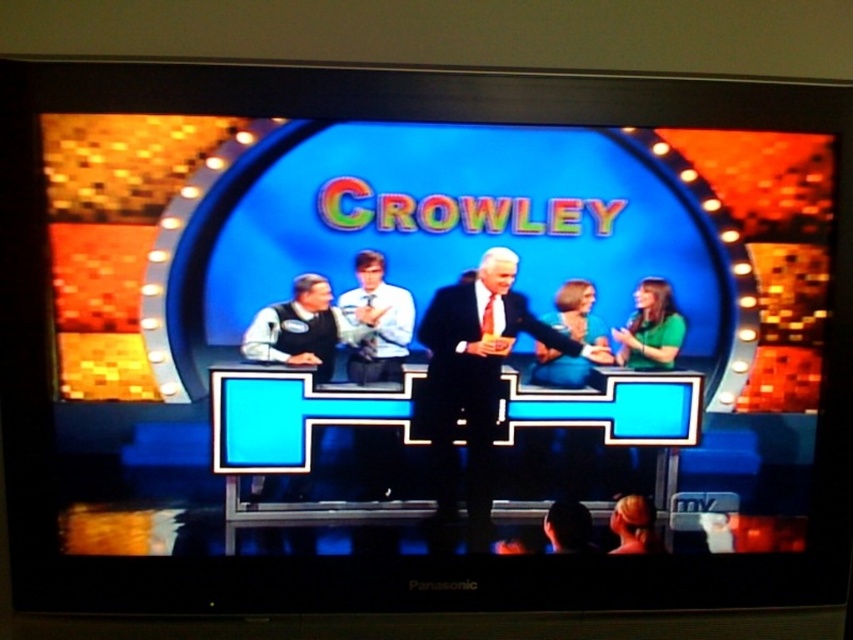
You are a camera operator adjusting the focus on a stage with two points marked for the crew. The points are labeled as point [445,385] and point [555,356]. If you need to focus on the point that is closer to the camera, which point should you select?

Point [445,385] is closer to the camera than point [555,356], so you should select point [445,385] for focusing.

You are a stagehand preparing for a performance. You notice two performers on stage wearing a black suit at center and a green fabric dress at center. Which performer is standing closer to the stage floor?

The black suit at center is below the green fabric dress at center, so the performer in the black suit at center is closer to the stage floor.